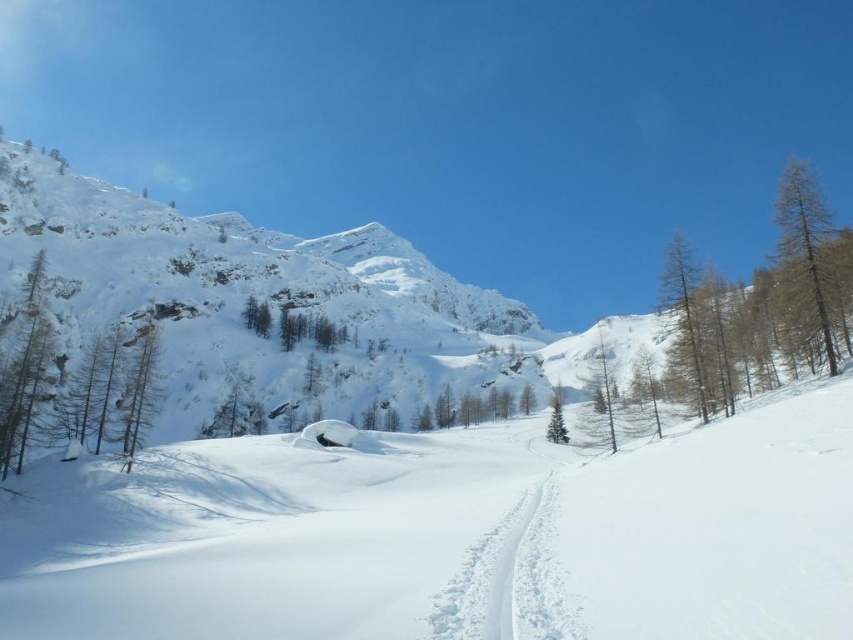
You are a hiker planning to cross the snow path. You see the brown wood tree at right and the smooth brown tree trunk at left. Which tree should you avoid stepping near to stay on the path?

You should avoid stepping near the brown wood tree at right because it is located below the smooth brown tree trunk at left, meaning it is closer to the path and could be in your way.

You are planning to ski down the white snow ski slope at center. There is a green smooth tree at right nearby. To avoid hitting the tree, should you steer left or right while descending?

The white snow ski slope at center might be wider than green smooth tree at right, so you should steer away from the tree. Since the tree is on the right side, steering left would keep you on the slope and avoid the tree.

You are planning a ski trip and want to know if the white snow ski slope at center can accommodate a large group of skiers. Considering the size of the green smooth tree at right, what can you infer about the slope?

The white snow ski slope at center is bigger than the green smooth tree at right, which suggests that the slope has sufficient space to accommodate a large group of skiers.